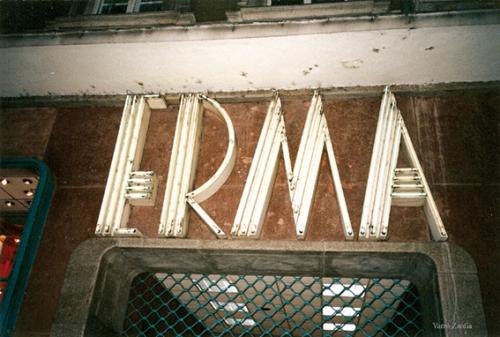
Locate an element on the screen. wall is located at coordinates (463, 158).